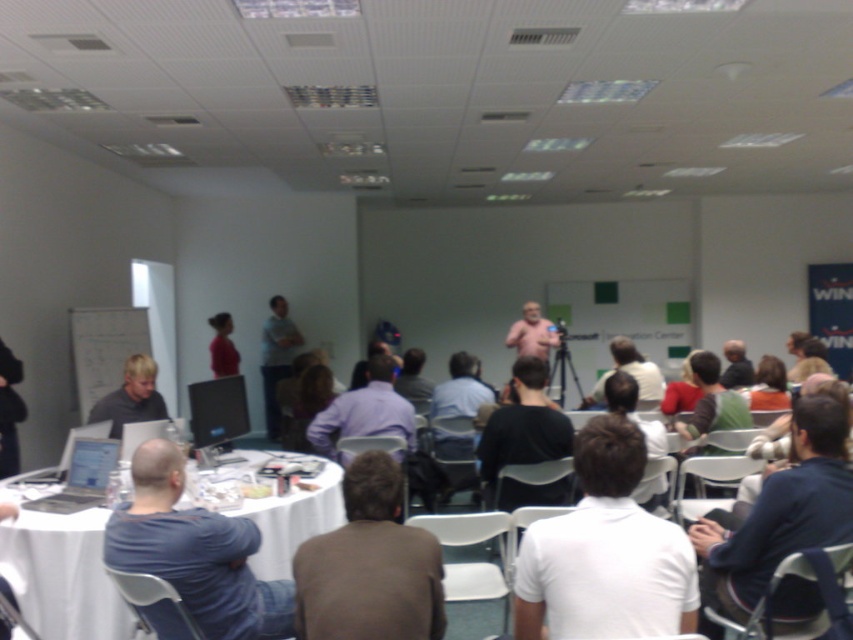
Between point (302, 634) and point (283, 314), which one is positioned in front?

Point (302, 634)

Does brown fabric shirt at center have a lesser height compared to light gray shirt at center?

Indeed, brown fabric shirt at center has a lesser height compared to light gray shirt at center.

Locate an element on the screen. The height and width of the screenshot is (640, 853). brown fabric shirt at center is located at coordinates (370, 564).

Does point (293, 566) come closer to viewer compared to point (225, 323)?

Yes, it is in front of point (225, 323).

Who is more distant from viewer, (308,570) or (233,346)?

Positioned behind is point (233,346).

Is point (367, 481) closer to viewer compared to point (216, 376)?

Yes, it is.

Where is `brown fabric shirt at center`? This screenshot has height=640, width=853. brown fabric shirt at center is located at coordinates (370, 564).

What do you see at coordinates (605, 552) in the screenshot? I see `white matte shirt at center` at bounding box center [605, 552].

Who is shorter, white matte shirt at center or light gray shirt at center?

Standing shorter between the two is white matte shirt at center.

Who is more forward, [689,612] or [282,298]?

Point [689,612]

Where is `white matte shirt at center`? The image size is (853, 640). white matte shirt at center is located at coordinates (605, 552).